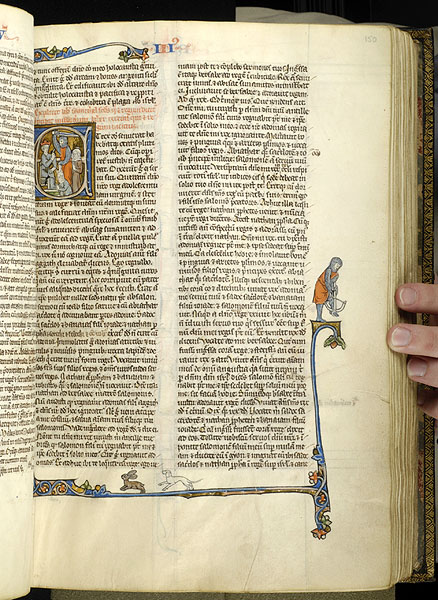
Where is `trim`? The height and width of the screenshot is (600, 438). trim is located at coordinates (322, 486), (48, 52).